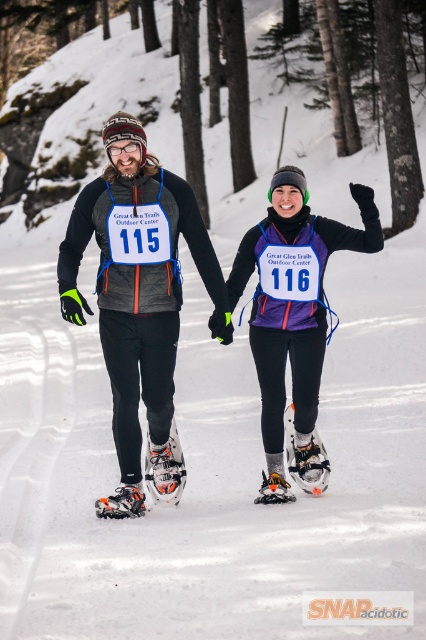
You are a photographer trying to capture the snowshoeing race. You want to take a photo that shows both the matte black snowshoes at center and the white mesh snowshoe at lower center in the same frame. Considering their sizes, which snowshoe will appear larger in the photo?

The matte black snowshoes at center will appear larger in the photo because they are much taller than the white mesh snowshoe at lower center.

You are a participant in the snowshoeing race and want to reach the finish line. You see two points marked on the trail ahead. The first point is at coordinate point(x=317, y=305) and the second point is at coordinate point(x=284, y=484). Which point should you reach first to stay on the correct path?

You should reach point(x=317, y=305) first because it is in front of point(x=284, y=484) along the trail.

You are a photographer trying to capture a clear photo of both the purple matte snowshoe at center and the orange plastic snowshoe at lower center. Since you want to focus on the taller one, which one should you adjust your camera to focus on?

The purple matte snowshoe at center is taller than the orange plastic snowshoe at lower center, so you should adjust your camera to focus on the purple matte snowshoe at center.